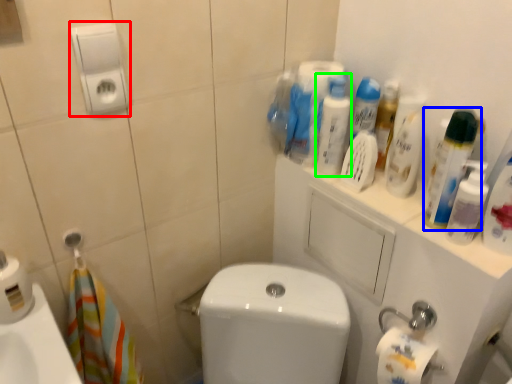
Question: Estimate the real-world distances between objects in this image. Which object is closer to hand dryer (highlighted by a red box), cleaning product (highlighted by a blue box) or cleaning product (highlighted by a green box)?

Choices:
 (A) cleaning product
 (B) cleaning product

Answer: (B)